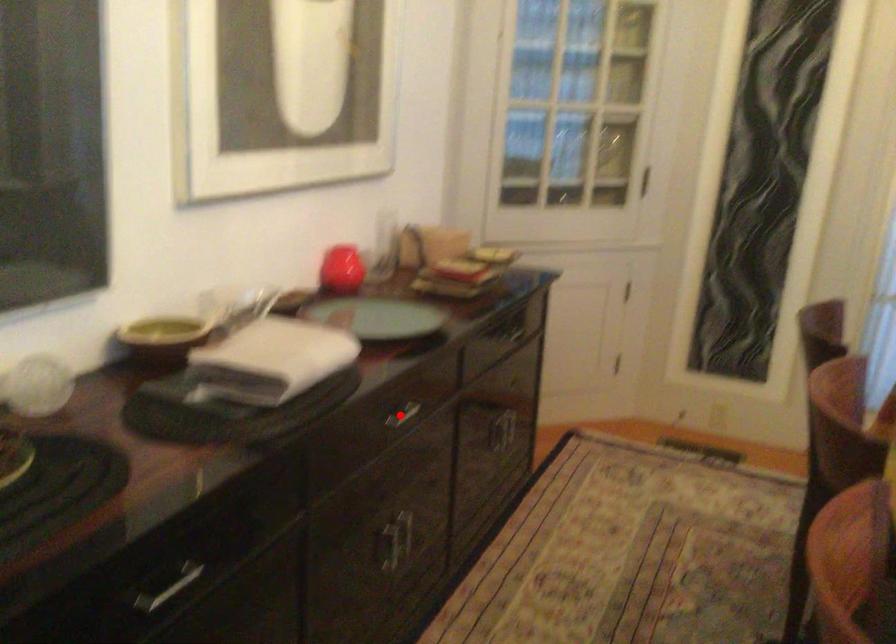
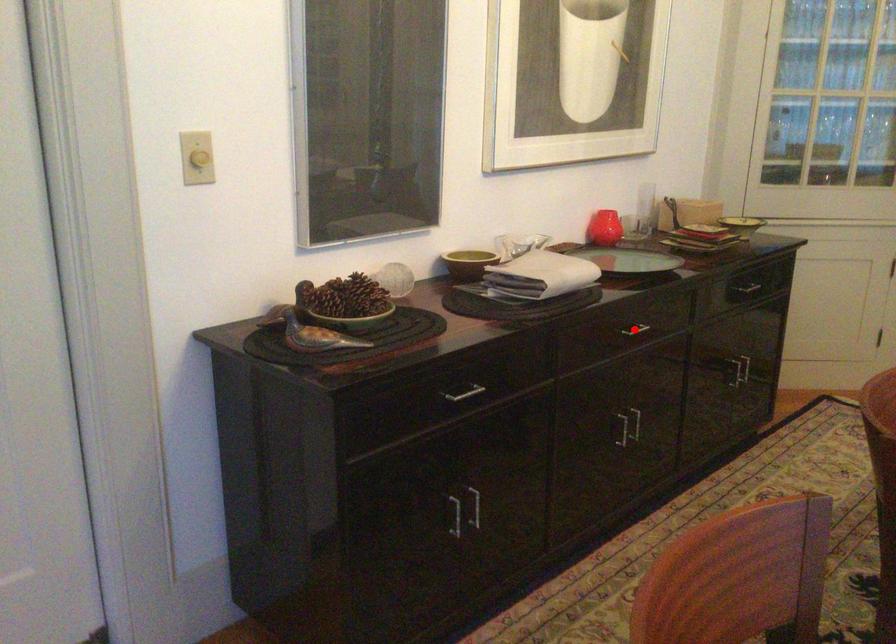
I am providing you with two images of the same scene from different viewpoints. A red point is marked on the first image and another point is marked on the second image. Are the points marked in image1 and image2 representing the same 3D position?

Yes